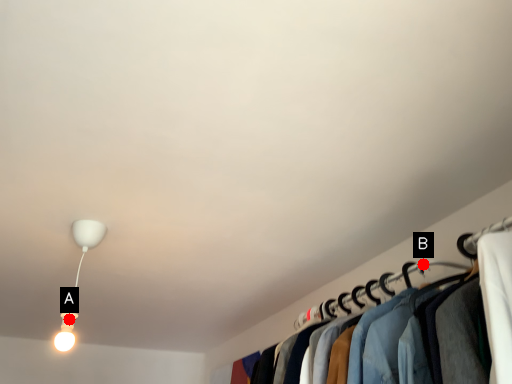
Question: Two points are circled on the image, labeled by A and B beside each circle. Which point is farther from the camera taking this photo?

Choices:
 (A) A is further
 (B) B is further

Answer: (A)